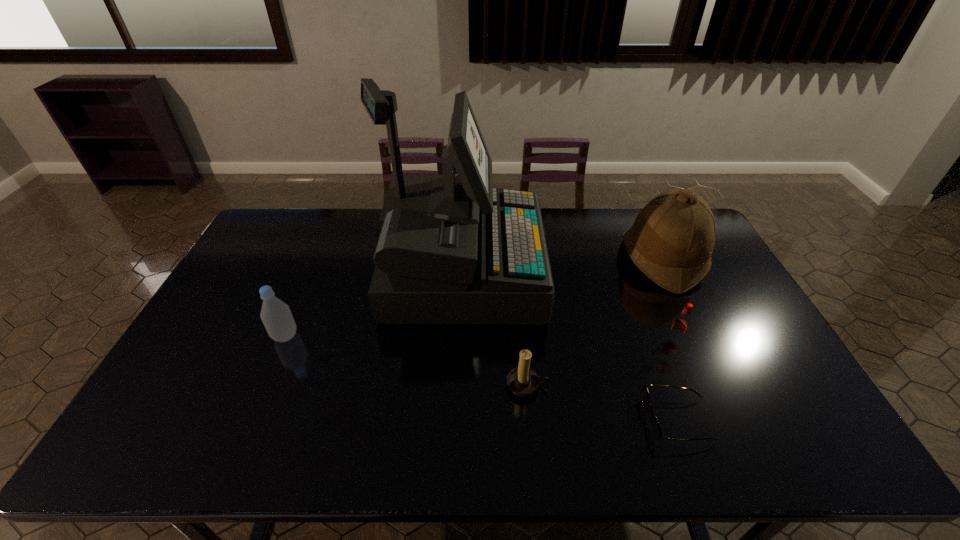
At what (x,y) coordinates should I click in order to perform the action: click on free space between the candle holder and the root beer. Please return your answer as a coordinate pair (x, y). The width and height of the screenshot is (960, 540). Looking at the image, I should click on (601, 363).

Identify the location of free spot between the leftmost object and the root beer. (480, 338).

You are a GUI agent. You are given a task and a screenshot of the screen. Output one action in this format:
    pyautogui.click(x=<x>, y=<y>)
    Task: Click on the vacant area that lies between the root beer and the leftmost object
    The image size is (960, 540).
    Given the screenshot: What is the action you would take?
    pyautogui.click(x=480, y=338)

You are a GUI agent. You are given a task and a screenshot of the screen. Output one action in this format:
    pyautogui.click(x=<x>, y=<y>)
    Task: Click on the free space between the spectacles and the tallest object
    
    Given the screenshot: What is the action you would take?
    pyautogui.click(x=569, y=346)

Find the location of `vacant point located between the candle holder and the fourth shortest object`. vacant point located between the candle holder and the fourth shortest object is located at coordinates (406, 361).

Locate an element on the screen. free space between the cash register and the candle holder is located at coordinates (493, 329).

Locate an element on the screen. The width and height of the screenshot is (960, 540). the fourth closest object to the root beer is located at coordinates (523, 381).

Find the location of a particular element. The height and width of the screenshot is (540, 960). the second closest object to the candle holder is located at coordinates (655, 427).

Identify the location of vacant area that satisfies the following two spatial constraints: 1. on the front side of the root beer; 2. on the left side of the leftmost object. This screenshot has width=960, height=540. (283, 340).

Identify the location of free space that satisfies the following two spatial constraints: 1. on the front-facing side of the hat; 2. on the wick of the candle holder. (722, 386).